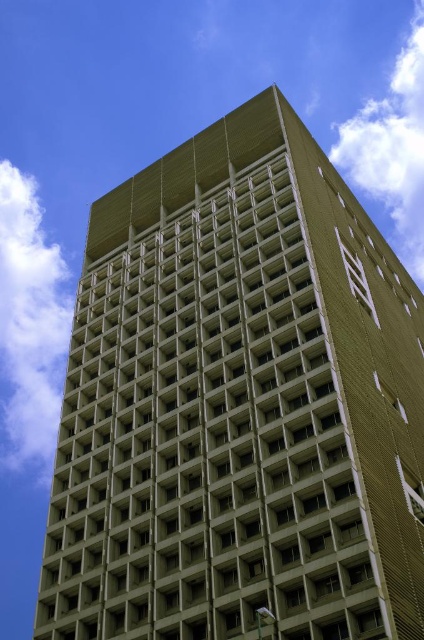
You are standing at the base of the tall, modern building and looking up at the white fluffy cloud at upper left. If you have a laser pointer, can you estimate whether the laser beam will reach the cloud?

The white fluffy cloud at upper left is 947.09 feet away from the viewer. Since typical consumer laser pointers have a range of around 200 feet, the laser beam will not reach the cloud.

You are an architect designing a new building and want to ensure that the two white fluffy clouds in the sky, specifically the white fluffy cloud at upper left and the white fluffy cloud at upper center, are depicted accurately in your blueprint. Which cloud should you indicate as needing more space in the design due to its larger size?

The white fluffy cloud at upper center requires more space in the design because it has a greater width than the white fluffy cloud at upper left.

You are standing in front of a tall modern building and looking up at the sky. You see two clouds, the white fluffy cloud at upper left and the white fluffy cloud at upper center. Which cloud is positioned lower in the sky?

The white fluffy cloud at upper left is located below the white fluffy cloud at upper center, so it is positioned lower in the sky.